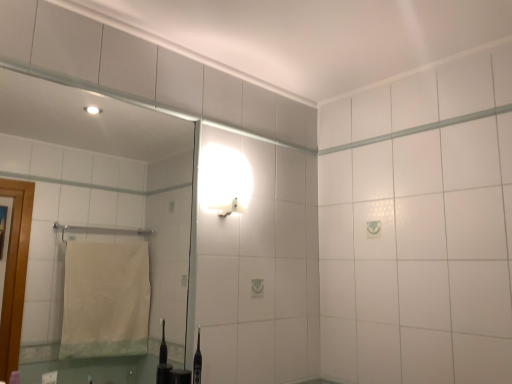
Question: In the image, is clear glass mirror at upper left positioned in front of or behind white glossy wall sconce at upper center?

Choices:
 (A) behind
 (B) front

Answer: (B)

Question: Is point (170, 213) closer or farther from the camera than point (229, 203)?

Choices:
 (A) closer
 (B) farther

Answer: (B)

Question: In the image, is clear glass mirror at upper left on the left side or the right side of white glossy wall sconce at upper center?

Choices:
 (A) left
 (B) right

Answer: (A)

Question: Considering the positions of point (236, 188) and point (67, 215), is point (236, 188) closer or farther from the camera than point (67, 215)?

Choices:
 (A) farther
 (B) closer

Answer: (B)

Question: Visually, is white glossy wall sconce at upper center positioned to the left or to the right of clear glass mirror at upper left?

Choices:
 (A) right
 (B) left

Answer: (A)

Question: From a real-world perspective, is white glossy wall sconce at upper center positioned above or below clear glass mirror at upper left?

Choices:
 (A) above
 (B) below

Answer: (A)

Question: In terms of size, does white glossy wall sconce at upper center appear bigger or smaller than clear glass mirror at upper left?

Choices:
 (A) small
 (B) big

Answer: (A)